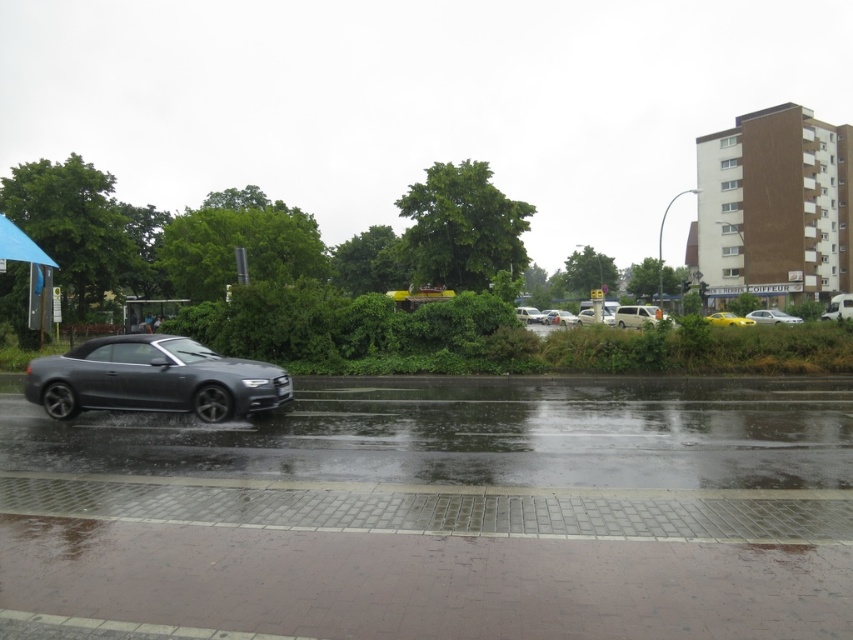
You are standing at the origin point of the image coordinate system and want to walk towards the glossy asphalt road at lower center. What are the coordinates you should head towards?

The glossy asphalt road at lower center is located at coordinates point (477, 433). So you should head towards coordinates point (477, 433).

You are standing at the point with coordinates point (x=587, y=314) and want to walk to the point (x=136, y=368). Given that the path between them is clear, will you be moving towards the road or away from it?

Since point (x=136, y=368) is in front of point (x=587, y=314), you will be moving towards the road.

You are standing on the sidewalk next to the low brick wall and want to cross the road to reach the grassy area. The glossy asphalt road at lower center is located at point 0.678, 0.560. Can you safely cross the road at this point?

The glossy asphalt road at lower center is located at point (477, 433), which is the exact spot where the road meets the grassy area. Since the grassy area is adjacent to the road, you can safely cross here.